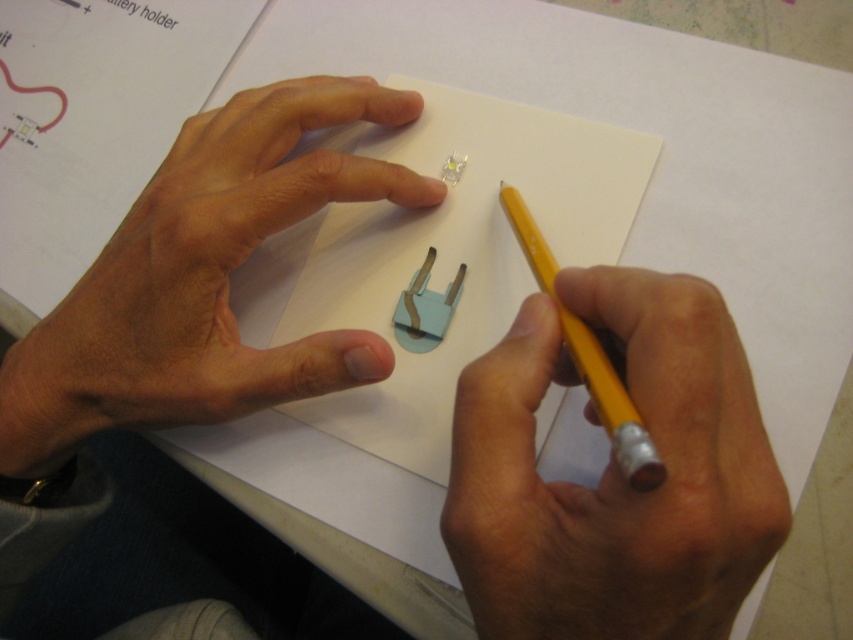
Does yellow wood pencil at center appear under dry skin at upper left?

Yes.

Is point (672, 454) positioned before point (80, 356)?

Yes, point (672, 454) is closer to viewer.

Which is in front, point (514, 330) or point (202, 214)?

Point (514, 330) is more forward.

At what (x,y) coordinates should I click in order to perform the action: click on yellow wood pencil at center. Please return your answer as a coordinate pair (x, y). This screenshot has height=640, width=853. Looking at the image, I should click on (614, 474).

Is yellow wood pencil at center closer to the viewer compared to yellow wood pencil at right?

That is False.

Does yellow wood pencil at center have a larger size compared to yellow wood pencil at right?

Indeed, yellow wood pencil at center has a larger size compared to yellow wood pencil at right.

What do you see at coordinates (614, 474) in the screenshot? This screenshot has height=640, width=853. I see `yellow wood pencil at center` at bounding box center [614, 474].

At what (x,y) coordinates should I click in order to perform the action: click on yellow wood pencil at center. Please return your answer as a coordinate pair (x, y). This screenshot has height=640, width=853. Looking at the image, I should click on (614, 474).

Does dry skin at upper left have a greater height compared to yellow wood pencil at right?

Yes.

Describe the element at coordinates (206, 275) in the screenshot. This screenshot has width=853, height=640. I see `dry skin at upper left` at that location.

The image size is (853, 640). Find the location of `dry skin at upper left`. dry skin at upper left is located at coordinates (206, 275).